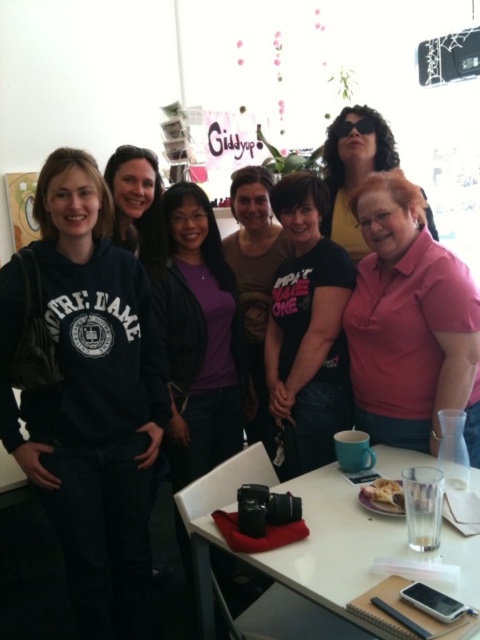
Does black matte t-shirt at center appear under matte black shirt at center?

Yes.

Is point (303, 296) closer to camera compared to point (254, 220)?

Yes, it is in front of point (254, 220).

Which is in front, point (305, 305) or point (259, 214)?

Point (305, 305) is in front.

Find the location of `black matte t-shirt at center`. black matte t-shirt at center is located at coordinates (309, 324).

Image resolution: width=480 pixels, height=640 pixels. What do you see at coordinates (90, 397) in the screenshot? I see `dark blue sweatshirt at left` at bounding box center [90, 397].

From the picture: Who is more distant from viewer, (148, 346) or (336, 160)?

The point (336, 160) is behind.

The height and width of the screenshot is (640, 480). What are the coordinates of `dark blue sweatshirt at left` in the screenshot? It's located at (90, 397).

Between point (358, 266) and point (315, 195), which one is positioned in front?

Positioned in front is point (358, 266).

Is pink matte shirt at lower right to the right of black matte t-shirt at center from the viewer's perspective?

Yes, pink matte shirt at lower right is to the right of black matte t-shirt at center.

Locate an element on the screen. This screenshot has width=480, height=640. pink matte shirt at lower right is located at coordinates (410, 323).